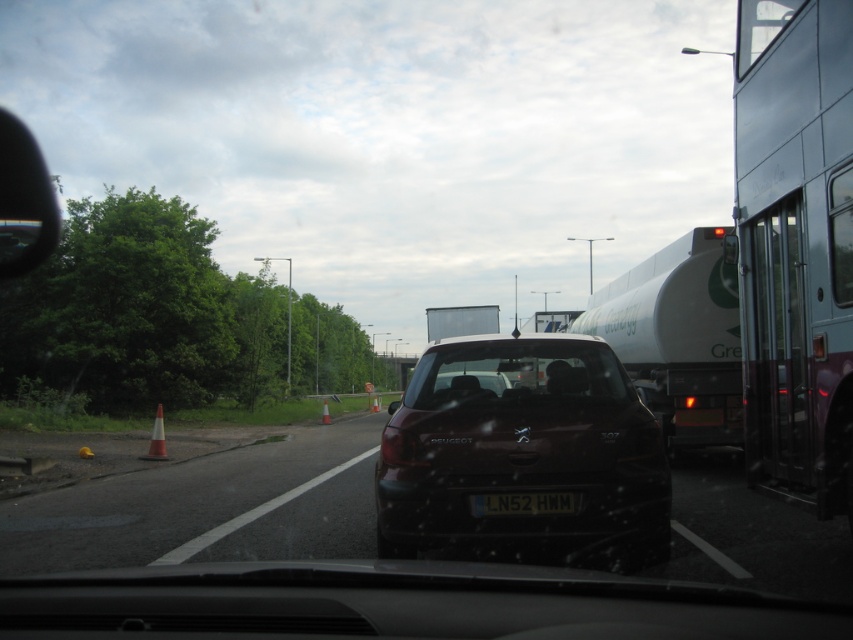
You are driving a car and see the orange traffic cone at center and the orange cone at center from your current position. Which one is closer to you?

The orange traffic cone at center is closer to the viewer than the orange cone at center.

You are a driver who needs to check the license plate of the car in front. Is the white plastic license plate at center easier to see than the orange traffic cone at center?

The white plastic license plate at center is smaller than orange traffic cone at center, so the orange traffic cone at center is larger and more visible, making the white plastic license plate at center harder to see.